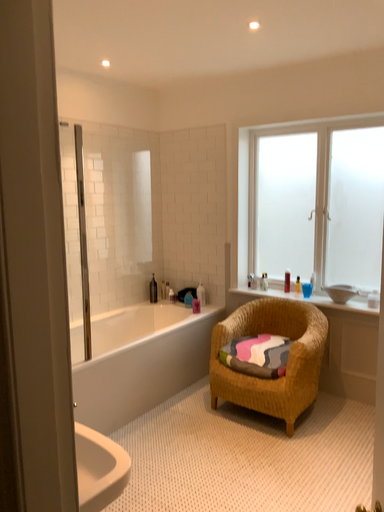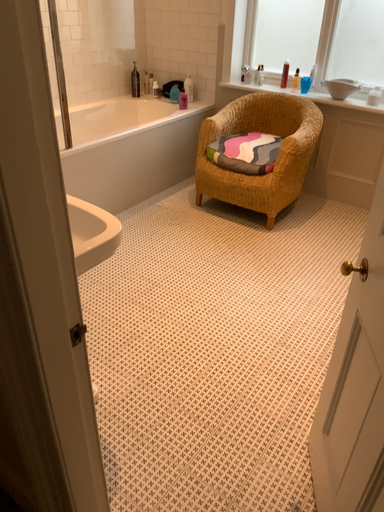
Question: How did the camera likely rotate when shooting the video?

Choices:
 (A) rotated downward
 (B) rotated upward

Answer: (A)